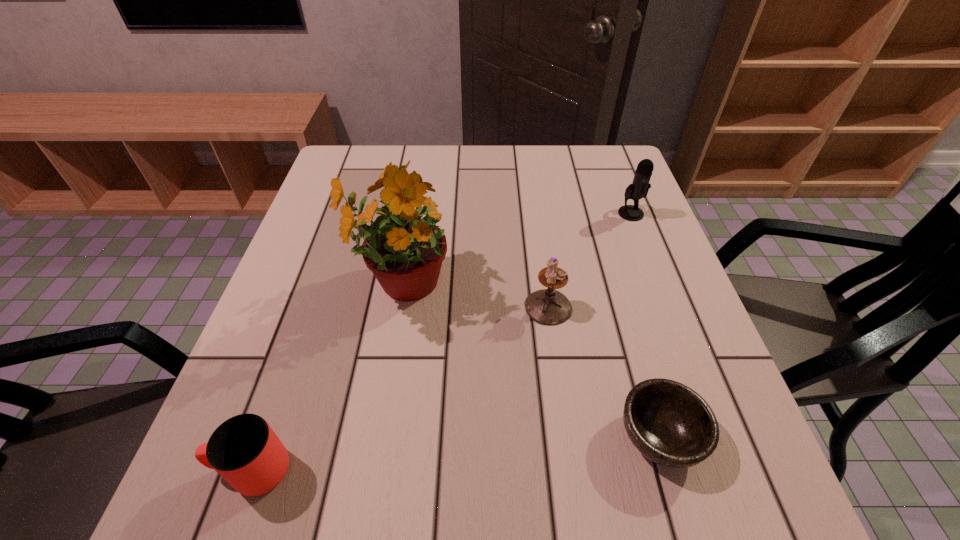
The width and height of the screenshot is (960, 540). What are the coordinates of `free area in between the microphone and the second shortest object` in the screenshot? It's located at (442, 342).

Identify the location of free spot between the bowl and the flowerpot. (530, 361).

In order to click on vacant region between the candle holder and the second object from left to right in this screenshot , I will do `click(474, 296)`.

Image resolution: width=960 pixels, height=540 pixels. I want to click on vacant point located between the flowerpot and the microphone, so click(x=516, y=249).

The height and width of the screenshot is (540, 960). What are the coordinates of `vacant space that's between the bowl and the second object from left to right` in the screenshot? It's located at (530, 361).

The height and width of the screenshot is (540, 960). Identify the location of empty space that is in between the flowerpot and the microphone. (516, 249).

Identify which object is located as the fourth nearest to the candle holder. Please provide its 2D coordinates. Your answer should be formatted as a tuple, i.e. [(x, y)], where the tuple contains the x and y coordinates of a point satisfying the conditions above.

[(244, 450)]

What are the coordinates of `object that ranks as the fourth closest to the bowl` in the screenshot? It's located at (244, 450).

Identify the location of free point that satisfies the following two spatial constraints: 1. on the handle side of the leftmost object; 2. on the left side of the flowerpot. (317, 285).

Identify the location of vacant space that satisfies the following two spatial constraints: 1. on the handle side of the bowl; 2. on the right side of the fourth tallest object. (264, 436).